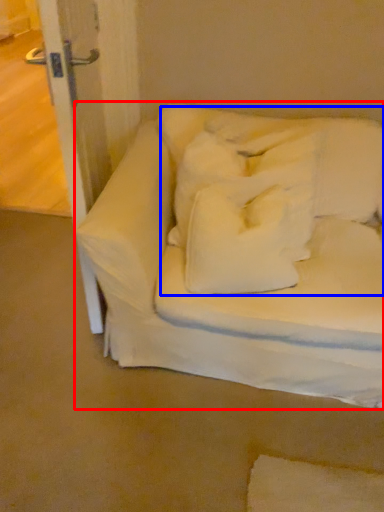
Question: Which object is closer to the camera taking this photo, furniture (highlighted by a red box) or bedding (highlighted by a blue box)?

Choices:
 (A) furniture
 (B) bedding

Answer: (A)